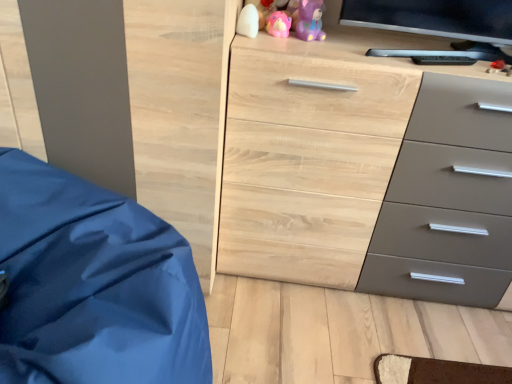
Image resolution: width=512 pixels, height=384 pixels. I want to click on vacant space to the right of purple matte bear at upper center, acting as the first toy starting from the right, so click(375, 49).